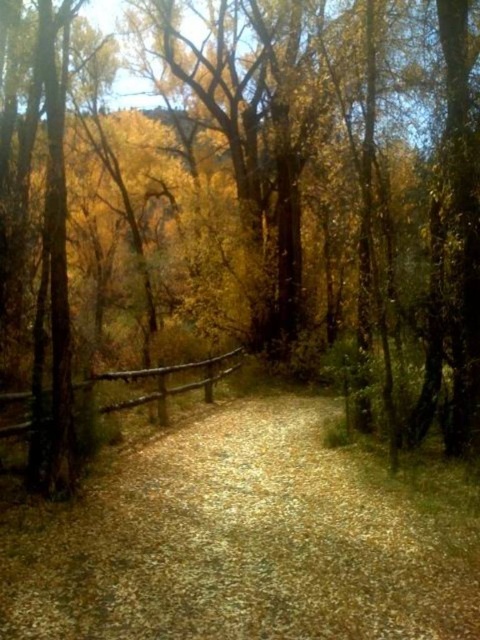
Question: Is gravelly dirt path at center smaller than brown wooden fence at left?

Choices:
 (A) no
 (B) yes

Answer: (B)

Question: Which of the following is the farthest from the observer?

Choices:
 (A) gravelly dirt path at center
 (B) brown wooden fence at left

Answer: (B)

Question: Which object appears farthest from the camera in this image?

Choices:
 (A) brown wooden fence at left
 (B) gravelly dirt path at center

Answer: (A)

Question: Is gravelly dirt path at center wider than brown wooden fence at left?

Choices:
 (A) yes
 (B) no

Answer: (B)

Question: Is gravelly dirt path at center thinner than brown wooden fence at left?

Choices:
 (A) yes
 (B) no

Answer: (A)